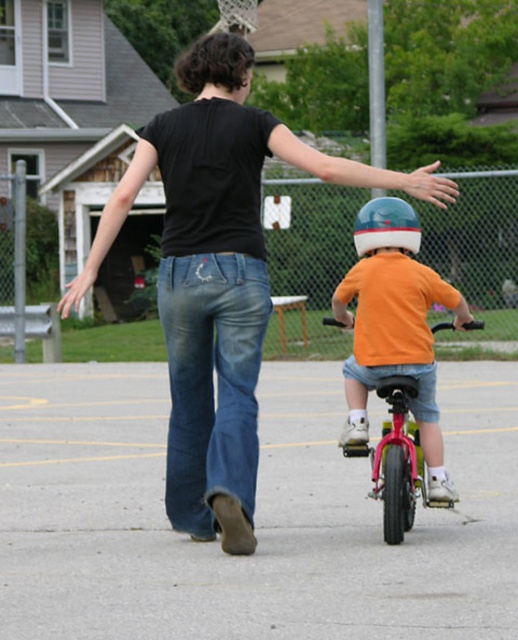
In the scene shown: You are a pedestrian trying to cross the street safely. You see the woman and the child in the scene. Where is the orange matte shirt at center located in relation to the point at coordinates (395, 326)?

The orange matte shirt at center is located exactly at the point with coordinates (395, 326).

Based on the provided scene, where exactly is the orange matte shirt at center located in terms of coordinates?

The orange matte shirt at center is located at coordinates point [395,326].